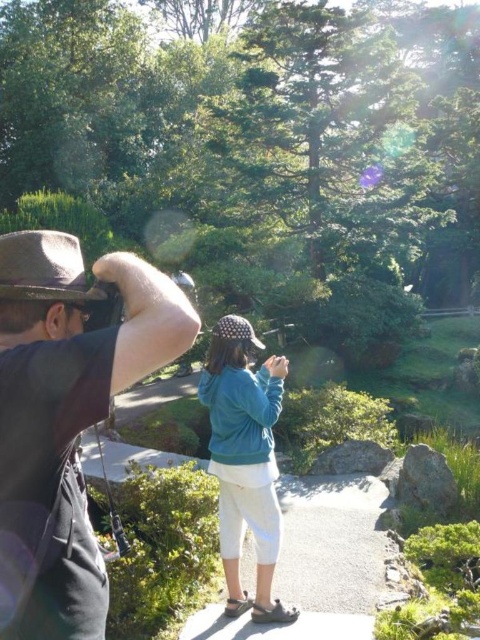
Is point (51, 344) closer to viewer compared to point (81, 253)?

Yes, it is in front of point (81, 253).

At what (x,y) coordinates should I click in order to perform the action: click on brown fabric hat at upper left. Please return your answer as a coordinate pair (x, y). Image resolution: width=480 pixels, height=640 pixels. Looking at the image, I should click on coord(66,419).

Is point (264, 385) closer to camera compared to point (58, 248)?

No, (264, 385) is further to viewer.

Which is in front, point (241, 328) or point (39, 276)?

Point (39, 276)

I want to click on teal fleece jacket at center, so (244, 460).

Between brown fabric hat at upper left and teal fleece jacket at center, which one appears on the right side from the viewer's perspective?

teal fleece jacket at center

Is brown fabric hat at upper left closer to the viewer compared to teal fleece jacket at center?

Yes, brown fabric hat at upper left is closer to the viewer.

Describe the element at coordinates (66, 419) in the screenshot. The image size is (480, 640). I see `brown fabric hat at upper left` at that location.

Find the location of a particular element. This screenshot has width=480, height=640. brown fabric hat at upper left is located at coordinates (66, 419).